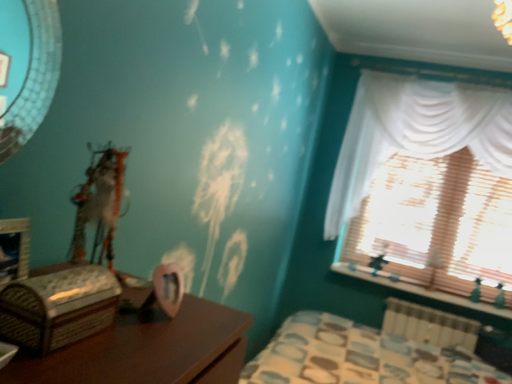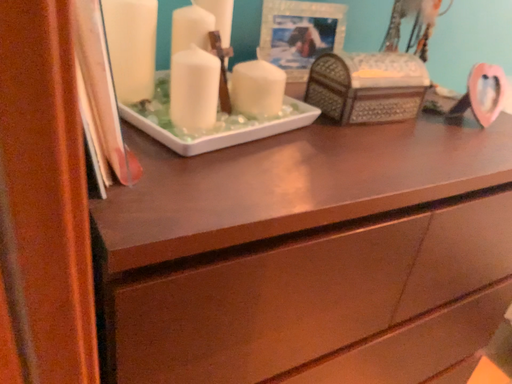
Question: How did the camera likely rotate when shooting the video?

Choices:
 (A) rotated downward
 (B) rotated upward

Answer: (A)